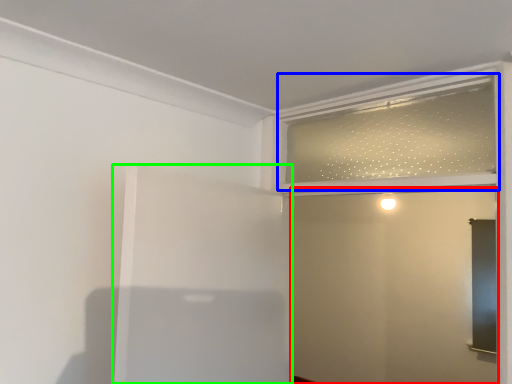
Question: Considering the real-world distances, which object is farthest from screen door (highlighted by a red box)? window frame (highlighted by a blue box) or elevator (highlighted by a green box)?

Choices:
 (A) window frame
 (B) elevator

Answer: (B)